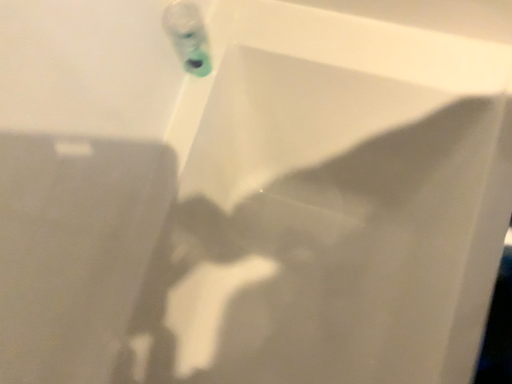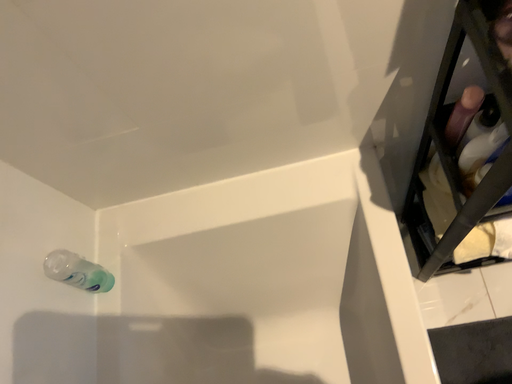
Question: Which way did the camera rotate in the video?

Choices:
 (A) rotated upward
 (B) rotated downward

Answer: (A)